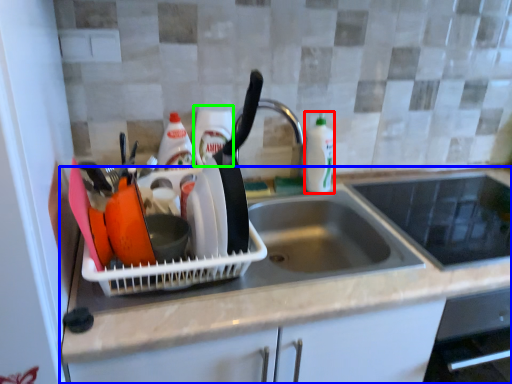
Question: Considering the real-world distances, which object is farthest from bottle (highlighted by a red box)? countertop (highlighted by a blue box) or bottle (highlighted by a green box)?

Choices:
 (A) countertop
 (B) bottle

Answer: (A)